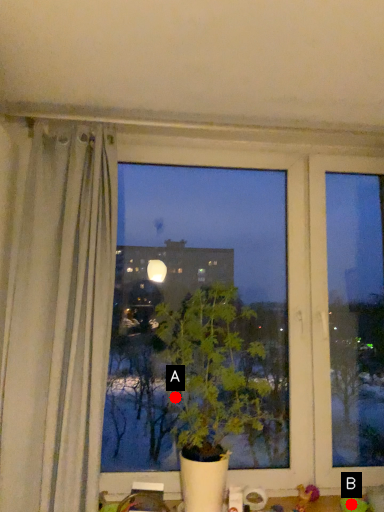
Question: Two points are circled on the image, labeled by A and B beside each circle. Which point is farther from the camera taking this photo?

Choices:
 (A) A is further
 (B) B is further

Answer: (A)